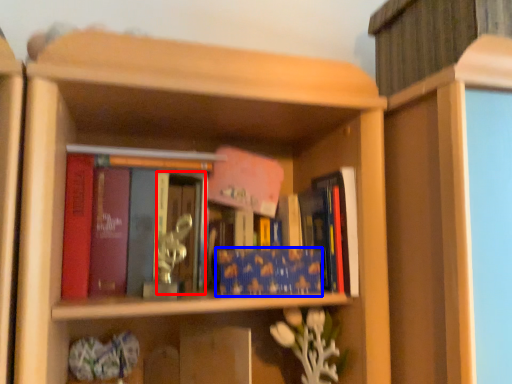
Question: Which object is closer to the camera taking this photo, glass door (highlighted by a red box) or book (highlighted by a blue box)?

Choices:
 (A) glass door
 (B) book

Answer: (A)